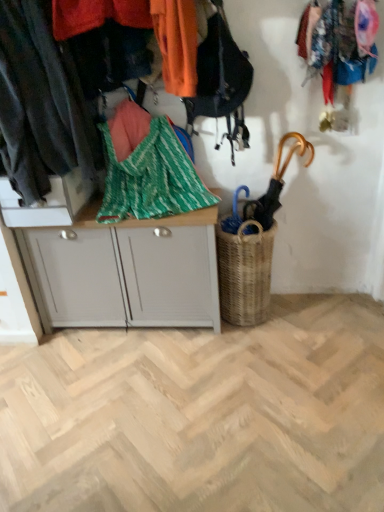
Question: Would you say dark gray fabric at left, which is the first clothing from left to right, is inside or outside white matte cabinet at center?

Choices:
 (A) outside
 (B) inside

Answer: (A)

Question: Considering the positions of dark gray fabric at left, which is the first clothing from left to right, and white matte cabinet at center in the image, is dark gray fabric at left, which is the first clothing from left to right, bigger or smaller than white matte cabinet at center?

Choices:
 (A) small
 (B) big

Answer: (A)

Question: Estimate the real-world distances between objects in this image. Which object is farther from the dark gray fabric at left, which is the first clothing from left to right?

Choices:
 (A) orange fabric at upper center, which appears as the second clothing when viewed from the left
 (B) white matte cabinet at center
 (C) green woven blanket at center
 (D) wooden umbrella at right
 (E) woven brown basket at center-right

Answer: (D)

Question: Based on their relative distances, which object is nearer to the woven brown basket at center-right?

Choices:
 (A) orange fabric at upper center, which appears as the second clothing when viewed from the left
 (B) wooden umbrella at right
 (C) dark gray fabric at left, which is the first clothing from left to right
 (D) green woven blanket at center
 (E) white matte cabinet at center

Answer: (B)